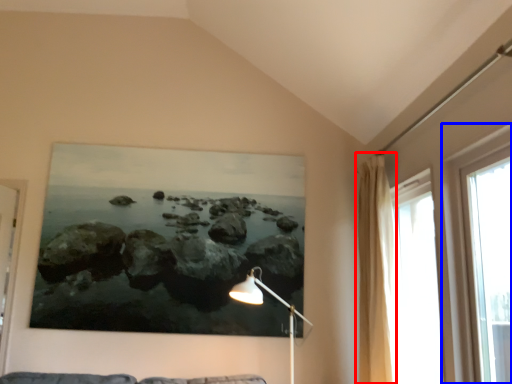
Question: Which object appears closest to the camera in this image, curtain (highlighted by a red box) or window (highlighted by a blue box)?

Choices:
 (A) curtain
 (B) window

Answer: (B)